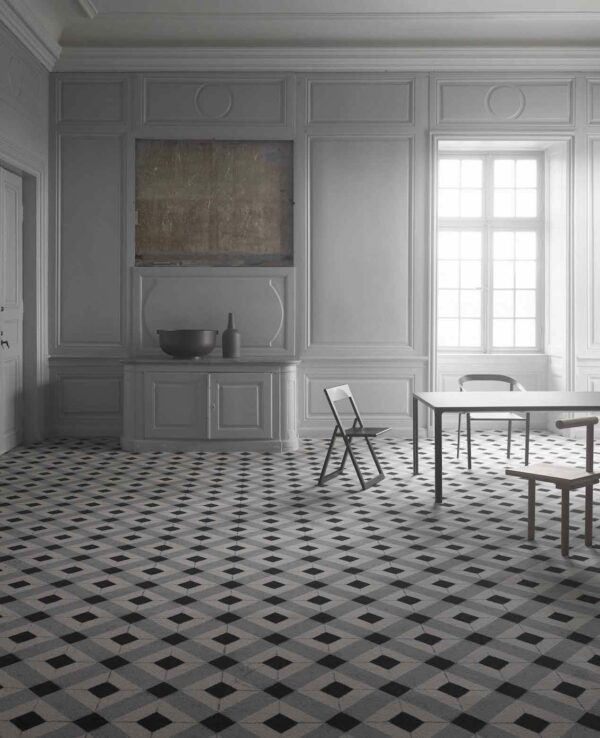
The image size is (600, 738). Find the location of `door`. door is located at coordinates (10, 240).